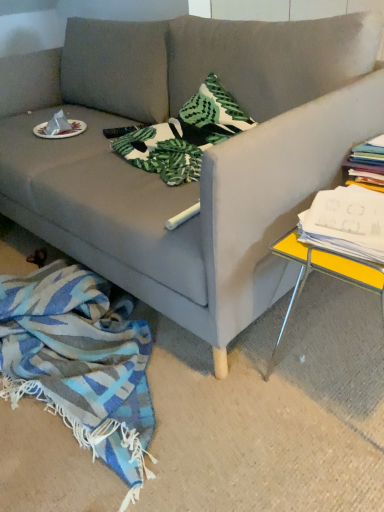
Question: In terms of height, does yellow metallic table at right look taller or shorter compared to blue woven blanket at lower left?

Choices:
 (A) short
 (B) tall

Answer: (B)

Question: In the image, is yellow metallic table at right positioned in front of or behind blue woven blanket at lower left?

Choices:
 (A) behind
 (B) front

Answer: (B)

Question: Which is farther from the blue woven blanket at lower left?

Choices:
 (A) white paper plate at upper left
 (B) matte gray couch at center
 (C) yellow metallic table at right
 (D) white paper stack at right

Answer: (A)

Question: Which of these objects is positioned farthest from the yellow metallic table at right?

Choices:
 (A) white paper plate at upper left
 (B) blue woven blanket at lower left
 (C) white paper stack at right
 (D) matte gray couch at center

Answer: (A)